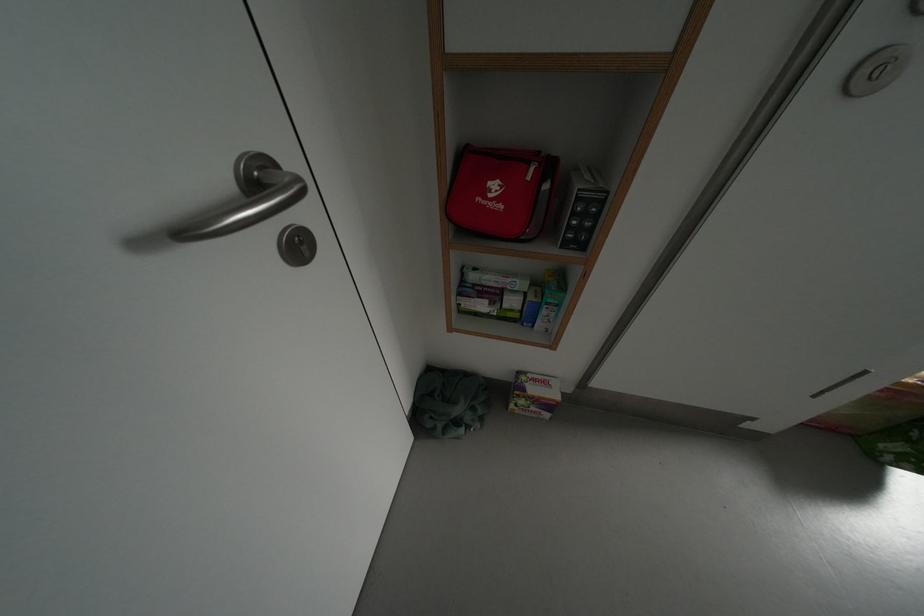
At what (x,y) coordinates should I click in order to perform the action: click on laundry detergent box. Please return your answer as a coordinate pair (x, y). The image size is (924, 616). Looking at the image, I should click on (533, 394).